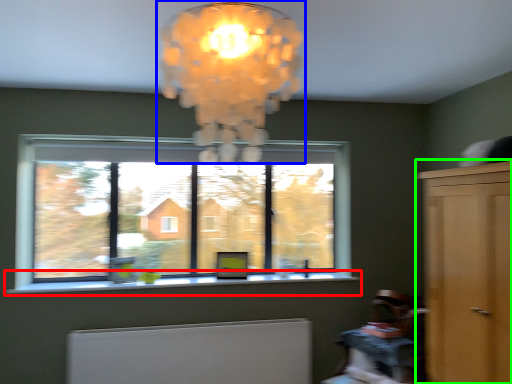
Question: Which is nearer to the window sill (highlighted by a red box)? lamp (highlighted by a blue box) or dresser (highlighted by a green box).

Choices:
 (A) lamp
 (B) dresser

Answer: (B)